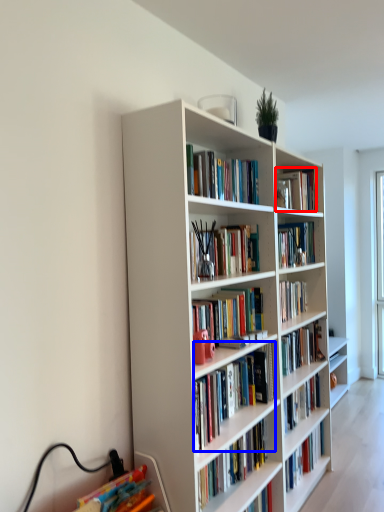
Question: Among these objects, which one is nearest to the camera, book (highlighted by a red box) or book (highlighted by a blue box)?

Choices:
 (A) book
 (B) book

Answer: (B)